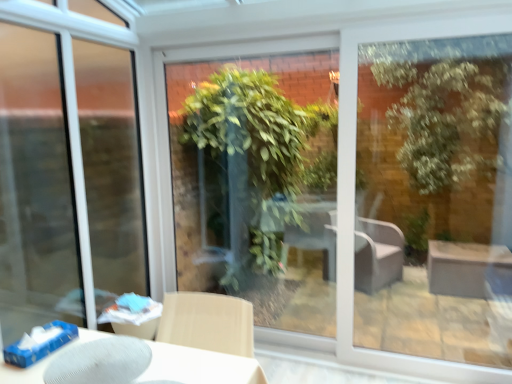
The image size is (512, 384). Describe the element at coordinates (199, 366) in the screenshot. I see `white textured plate at lower left` at that location.

Locate an element on the screen. Image resolution: width=512 pixels, height=384 pixels. white textured plate at lower left is located at coordinates (199, 366).

Where is `white textured plate at lower left`? This screenshot has width=512, height=384. white textured plate at lower left is located at coordinates (199, 366).